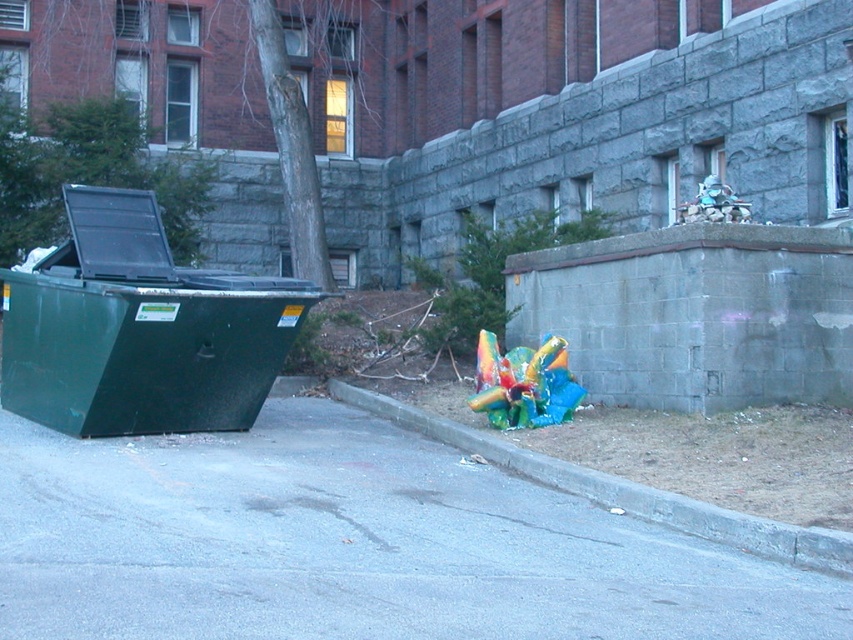
You are a delivery person with a box that is 3 feet wide. You need to place it on the ground between the gray asphalt pavement at lower center and the gray concrete curb at lower right. Is there enough space for the box?

The distance between the gray asphalt pavement at lower center and the gray concrete curb at lower right is 39.02 inches. Since 3 feet equals 36 inches, the space is sufficient to place the box as 39.02 inches is greater than 36 inches.

You are a delivery person trying to park your bike. You see the gray asphalt pavement at lower center and the gray concrete curb at lower right. Which surface should you place your bike on to ensure it stays stable?

The gray concrete curb at lower right is a better choice for parking the bike because the gray asphalt pavement at lower center is located below it, which might be lower and less stable.